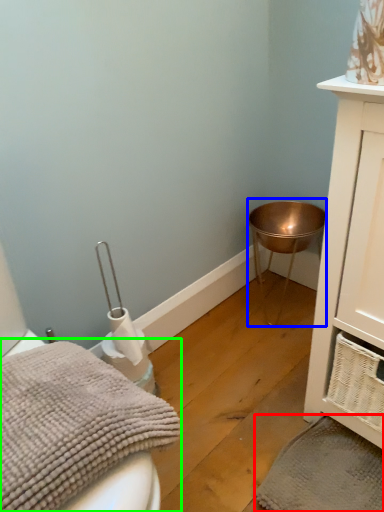
Question: Which object is positioned farthest from bath towel (highlighted by a red box)? Select from changing table (highlighted by a blue box) and bath towel (highlighted by a green box).

Choices:
 (A) changing table
 (B) bath towel

Answer: (A)